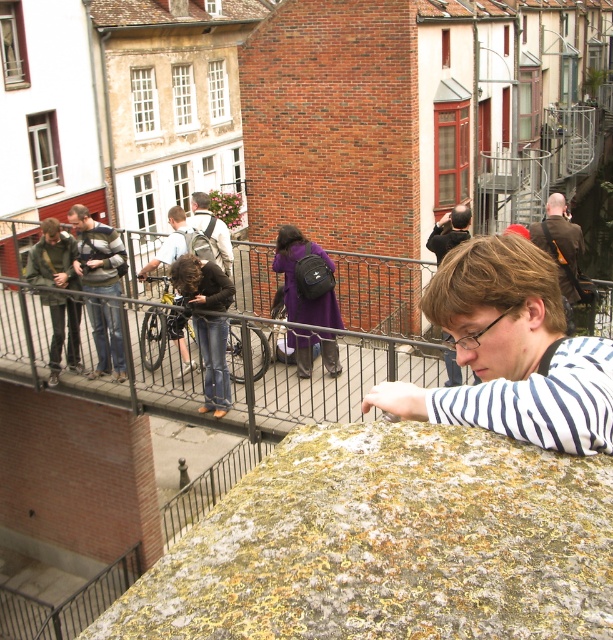
You are standing on the elevated vantage point overlooking the pedestrian bridge. You notice the mossy stone at center and the purple matte coat at center. From your perspective, which object is positioned to the left?

The purple matte coat at center is positioned to the left of the mossy stone at center.

You are a photographer trying to capture a candid shot of the purple matte coat at center and denim jeans at center. Since you want to focus on the clothing items, which one should you zoom in on more to ensure it takes up more space in your photo?

The purple matte coat at center is wider than denim jeans at center, so you should zoom in more on the purple matte coat at center to ensure it takes up more space in the photo.

You are a photographer trying to capture a shot of both the purple matte coat at center and the dark brown leather jacket at upper right. Based on their positions, which one is closer to the left side of your frame?

The purple matte coat at center is positioned to the left of the dark brown leather jacket at upper right, so it is closer to the left side of the frame.